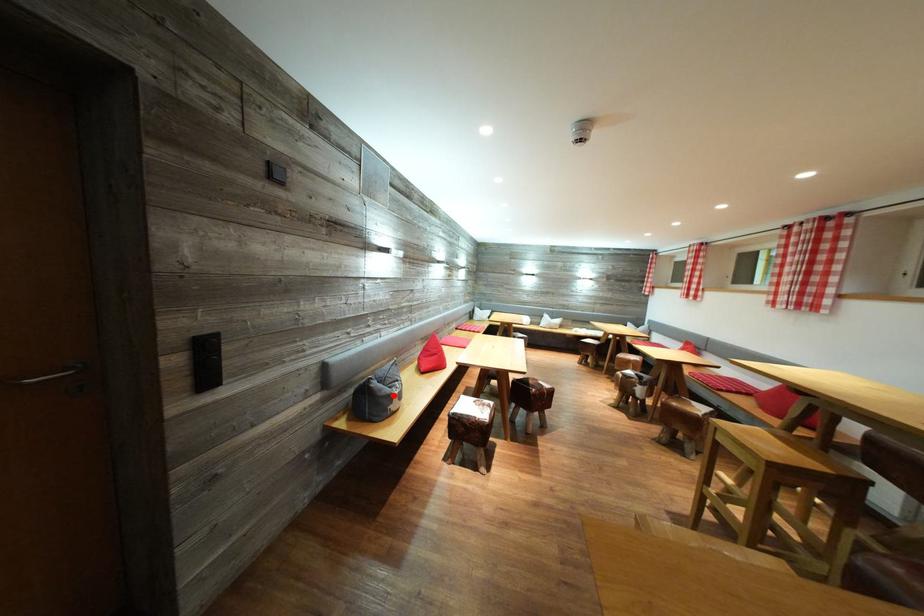
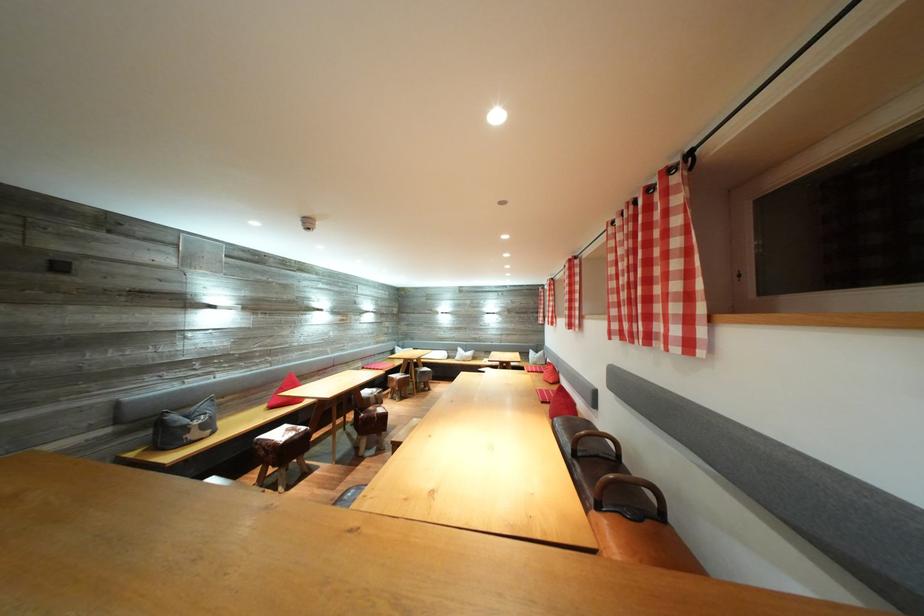
Question: I am providing you with two images of the same scene from different viewpoints. In image1, a red point is highlighted. Considering the same 3D point in image2, which of the following is correct?

Choices:
 (A) It is closer
 (B) It is farther

Answer: (B)